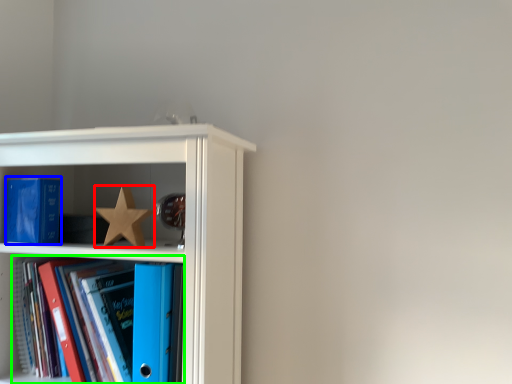
Question: Which is farther away from star (highlighted by a red box)? paperback book (highlighted by a blue box) or book (highlighted by a green box)?

Choices:
 (A) paperback book
 (B) book

Answer: (B)